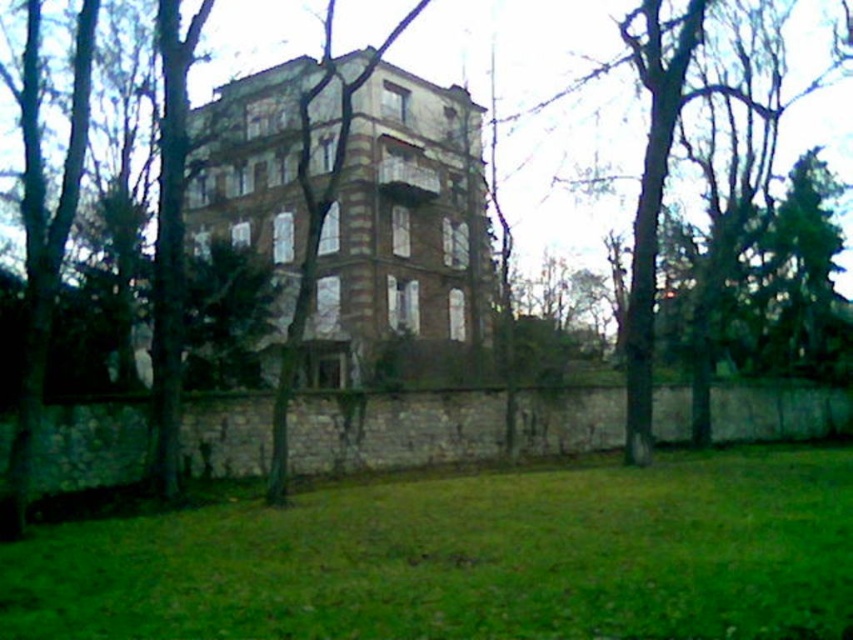
You are a landscape architect planning to install a new pathway between the green grass at lower center and the brown textured building at center. The pathway needs to be at least 10 meters long to accommodate a walking area. Based on the scene, will the existing space between them allow for this pathway?

The distance between the green grass at lower center and the brown textured building at center is 10.85 meters, which is longer than the required 10 meters. Therefore, the existing space allows for the pathway.

You are standing in front of the building and want to walk towards the green grass at lower center. Which direction should you move relative to the brown textured building at center?

The green grass at lower center is in front of the brown textured building at center, so you should move forward towards the grass, which is located in front of the building.

You are standing at the point marked as point (467,557). Looking around, you see green grass at lower center. What is the immediate surface you are standing on?

The immediate surface you are standing on is the green grass at lower center located at point (467,557).